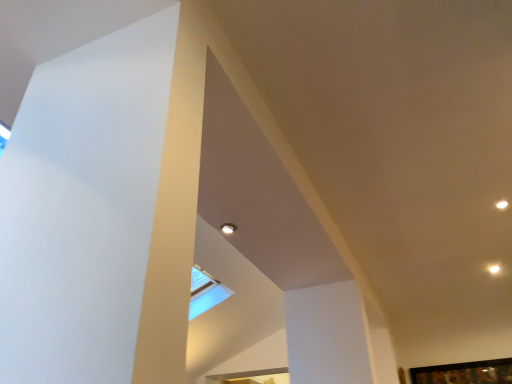
Question: Should I look upward or downward to see matte white light at upper center?

Choices:
 (A) up
 (B) down

Answer: (B)